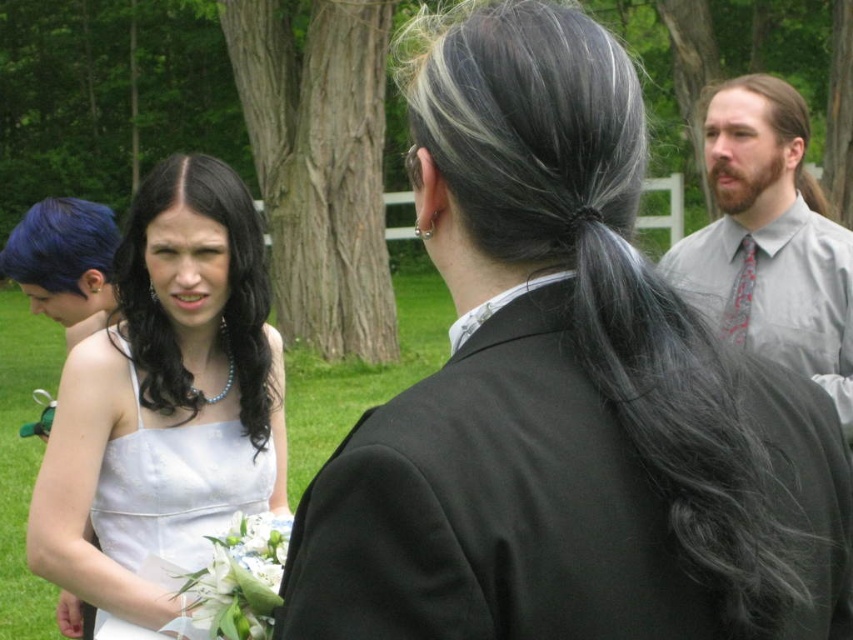
You are standing at the origin point of the image. There is a black silky hair at upper center located at point (602,269). If you want to move towards the black silky hair at upper center, in which direction should you move?

To move towards the black silky hair at upper center located at point (602,269) from the origin, you should move northeast since the coordinates indicate a position northeast of the origin.

You are standing at the center of the image. Which direction should you walk to reach the white satin dress at left?

You should walk to the left to reach the white satin dress at left since it is located at the left side of the image.